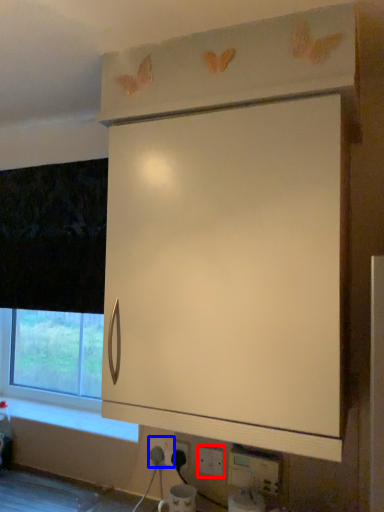
Question: Which point is closer to the camera, electric outlet (highlighted by a red box) or electric outlet (highlighted by a blue box)?

Choices:
 (A) electric outlet
 (B) electric outlet

Answer: (A)